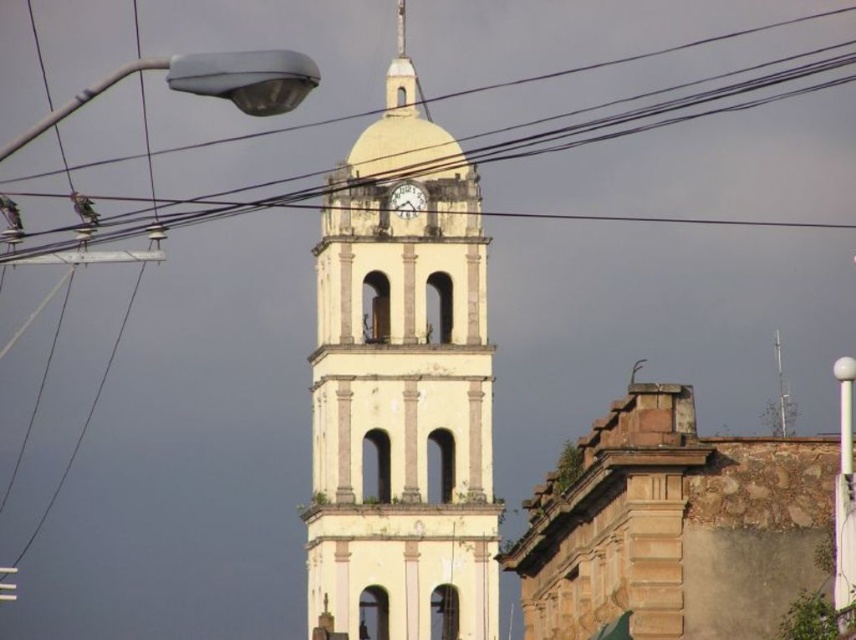
You are standing at the base of the historic bell tower and want to know how far you are from the point marked at coordinates point [479,241]. Can you determine the distance?

The distance between you and point [479,241] is 168.08 meters.

You are standing at the base of the bell tower and want to take a photo of the point at coordinates point (146, 220). If your camera can focus on objects up to 200 meters away, will you be able to capture the point clearly?

The point point (146, 220) is 196.72 meters away from the camera. Since this distance is within the camera maximum focus range of 200 meters, the camera can capture the point clearly.